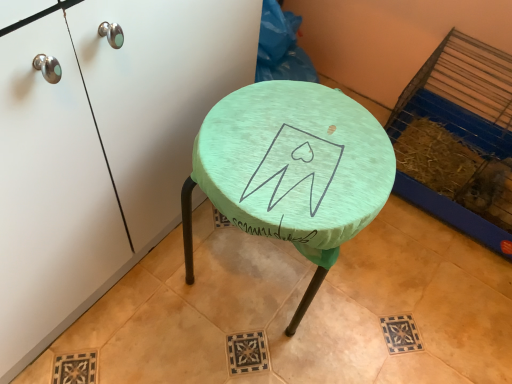
Where is `free spot above teal fabric stool at center (from a real-world perspective)`? This screenshot has width=512, height=384. free spot above teal fabric stool at center (from a real-world perspective) is located at coordinates (312, 153).